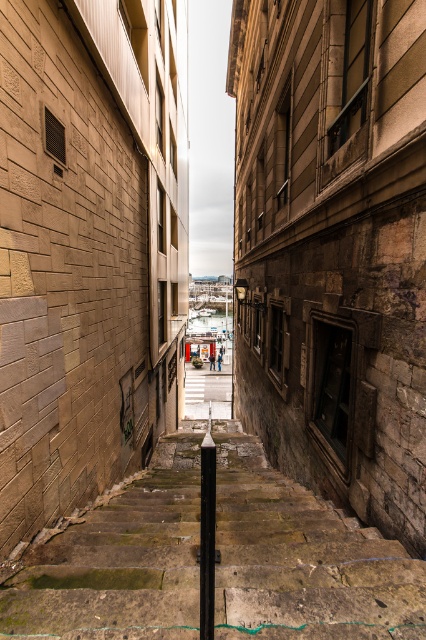
You are a delivery person carrying a heavy package and need to navigate the narrow urban staircase. The green mossy stone stairs at center and the brick wall at center are in your path. Which object is on the right side when facing the staircase?

The green mossy stone stairs at center is positioned on the right side of the brick wall at center, so when facing the staircase, the green mossy stone stairs at center will be on your right side.

You are a delivery person trying to navigate through the narrow urban staircase. The green mossy stone stairs at center and the brick wall at center are in your path. Which object takes up more space in the scene?

The brick wall at center occupies more space than the green mossy stone stairs at center according to the description.

You are a delivery person carrying a large package that is 1 meter wide. You need to navigate through the narrow urban staircase shown in the image. Can you pass through the space between the green mossy stone stairs at center and the brick wall at center?

The green mossy stone stairs at center is thinner than brick wall at center. Since the package is 1 meter wide, you need to check if the space between them is at least 1 meter. However, the description only states the stairs are thinner than the wall, but does not provide exact measurements. Therefore, it is unclear if the space is wide enough for the package.